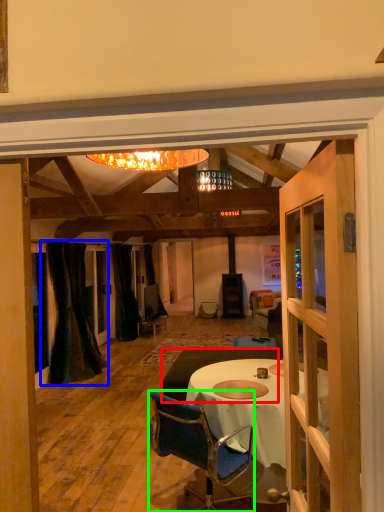
Question: Estimate the real-world distances between objects in this image. Which object is farther from studio couch (highlighted by a red box), curtain (highlighted by a blue box) or chair (highlighted by a green box)?

Choices:
 (A) curtain
 (B) chair

Answer: (A)